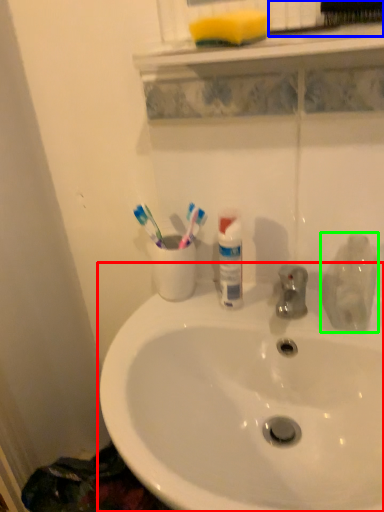
Question: Which is nearer to the sink (highlighted by a red box)? brush (highlighted by a blue box) or cleaning product (highlighted by a green box).

Choices:
 (A) brush
 (B) cleaning product

Answer: (B)